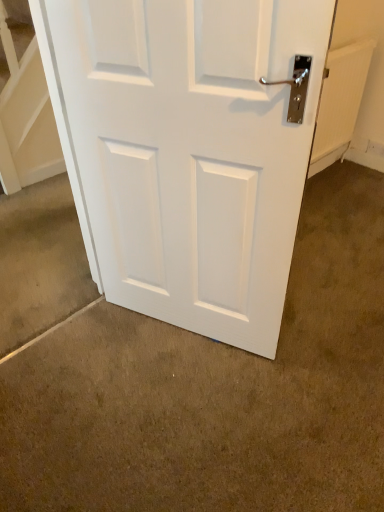
Find the location of a particular element. free space above white matte door at center (from a real-world perspective) is located at coordinates (274, 358).